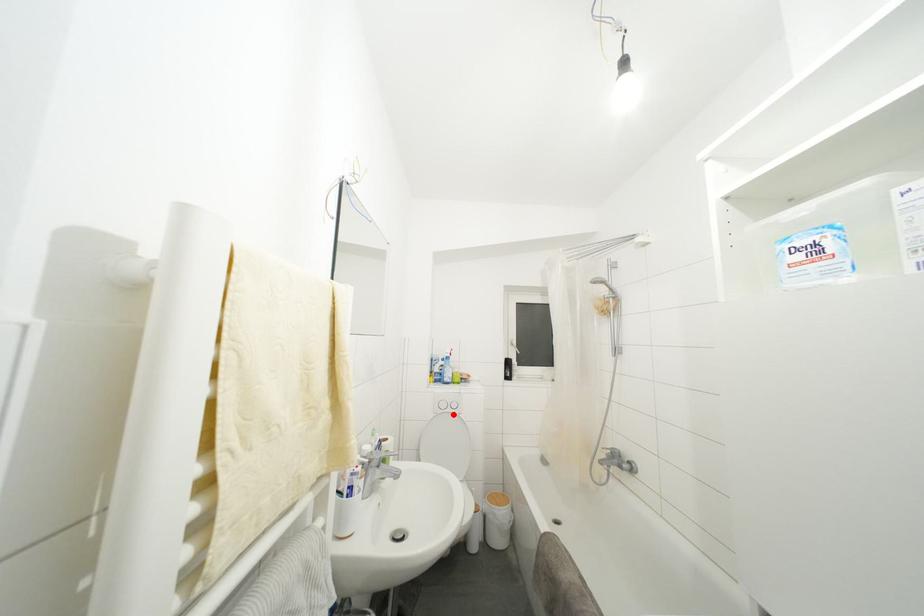
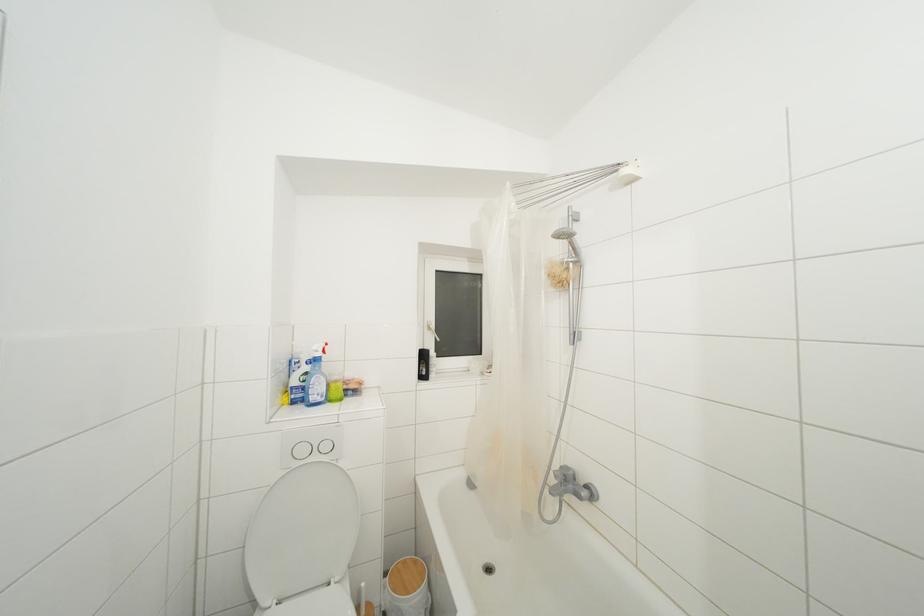
Question: I am providing you with two images of the same scene from different viewpoints. A red point is shown in image1. For the corresponding object point in image2, is it positioned nearer or farther from the camera?

Choices:
 (A) Nearer
 (B) Farther

Answer: (A)